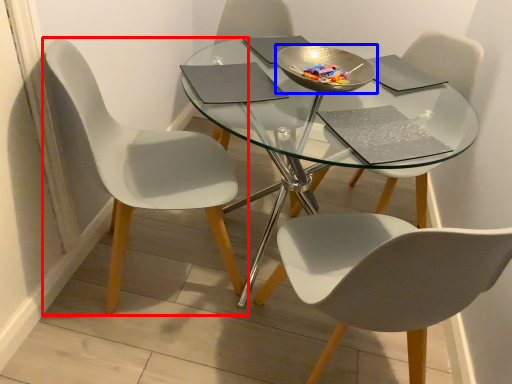
Question: Which point is further to the camera, chair (highlighted by a red box) or bowl (highlighted by a blue box)?

Choices:
 (A) chair
 (B) bowl

Answer: (B)